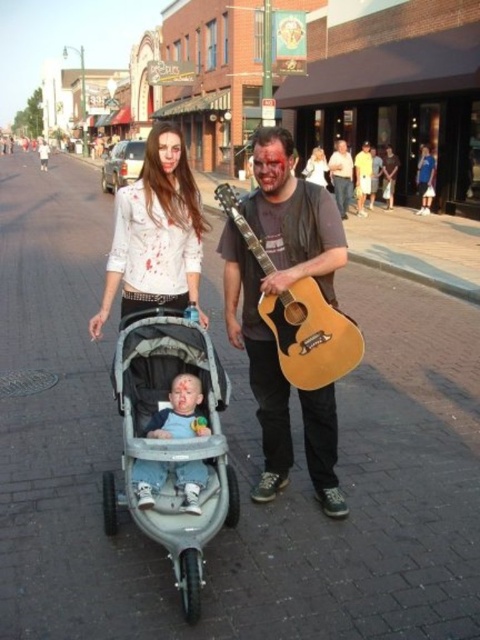
Question: Which of the following is the farthest from the observer?

Choices:
 (A) (331, 344)
 (B) (180, 394)
 (C) (337, 164)

Answer: (C)

Question: Observing the image, what is the correct spatial positioning of light brown acoustic guitar at center in reference to light blue denim pants at center?

Choices:
 (A) right
 (B) left

Answer: (A)

Question: Which point appears closest to the camera in this image?

Choices:
 (A) (313, 148)
 (B) (123, 211)
 (C) (348, 339)
 (D) (346, 218)

Answer: (C)

Question: Does light brown acoustic guitar at center appear on the right side of light blue denim pants at center?

Choices:
 (A) yes
 (B) no

Answer: (A)

Question: In this image, where is light blue denim pants at center located relative to light brown leather jacket at upper center?

Choices:
 (A) above
 (B) below

Answer: (B)

Question: Which point is farther to the camera?

Choices:
 (A) light brown leather jacket at upper center
 (B) matte yellow shirt at center
 (C) matte white shirt at center

Answer: (B)